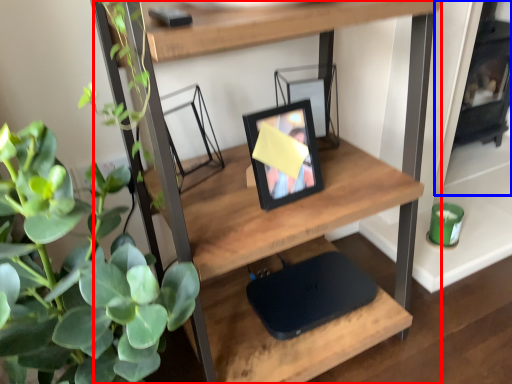
Question: Among these objects, which one is farthest to the camera, shelf (highlighted by a red box) or fireplace (highlighted by a blue box)?

Choices:
 (A) shelf
 (B) fireplace

Answer: (B)